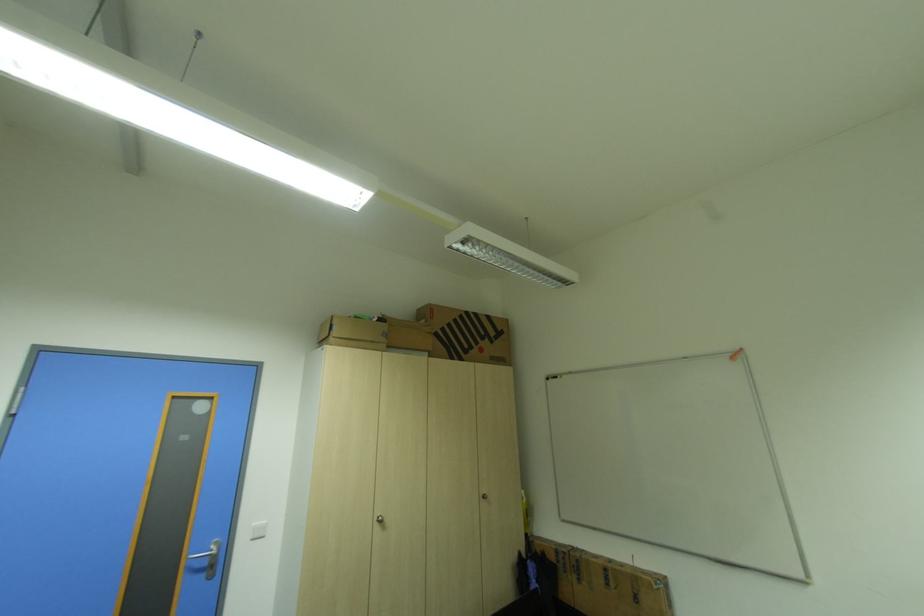
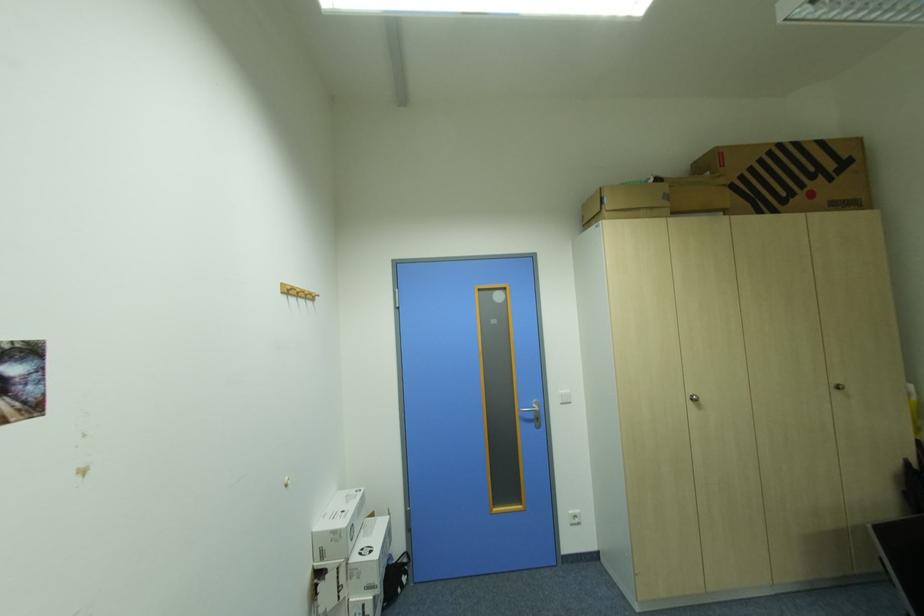
In the second image, find the point that corresponds to pixel 338 338 in the first image.

(612, 211)